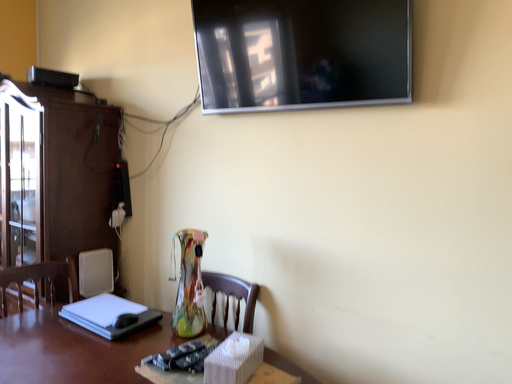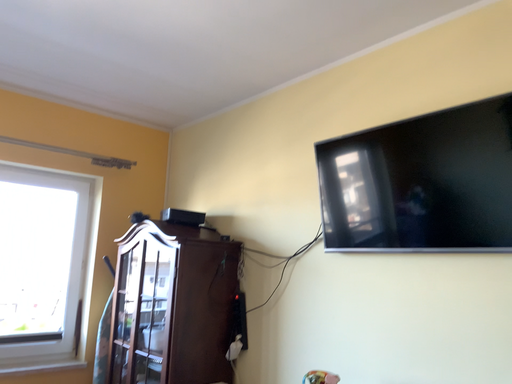
Question: How did the camera likely rotate when shooting the video?

Choices:
 (A) rotated right
 (B) rotated left

Answer: (B)